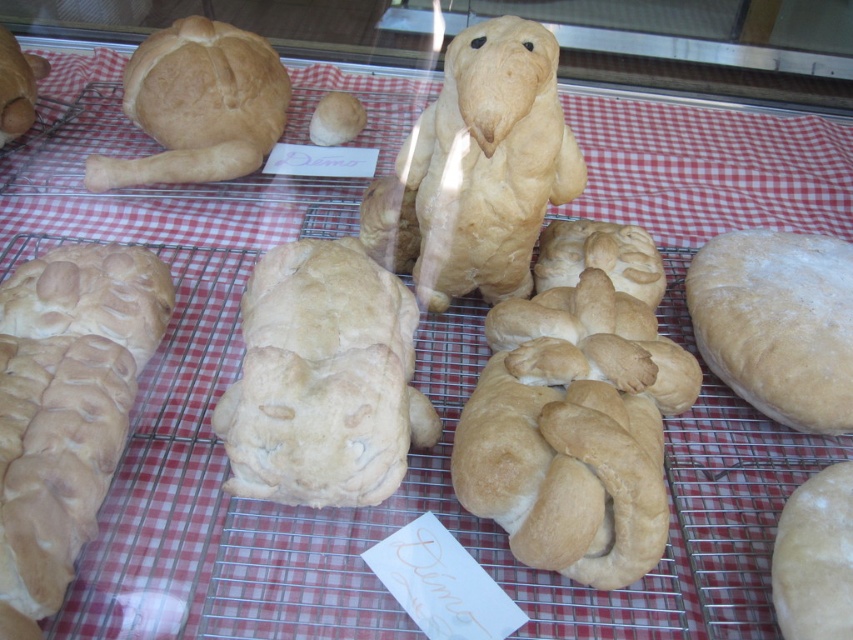
Is point (6, 499) closer to viewer compared to point (152, 161)?

Yes, point (6, 499) is in front of point (152, 161).

You are a GUI agent. You are given a task and a screenshot of the screen. Output one action in this format:
    pyautogui.click(x=<x>, y=<y>)
    Task: Click on the golden brown crusty loaf at lower left
    The height and width of the screenshot is (640, 853).
    Given the screenshot: What is the action you would take?
    pyautogui.click(x=67, y=408)

Identify the location of golden brown crusty loaf at lower left. The height and width of the screenshot is (640, 853). (67, 408).

Between point (49, 259) and point (289, 340), which one is positioned in front?

Point (289, 340) is in front.

Can you confirm if golden brown crusty loaf at lower left is positioned to the left of golden brown doughnut at center?

Yes, golden brown crusty loaf at lower left is to the left of golden brown doughnut at center.

The image size is (853, 640). What are the coordinates of `golden brown crusty loaf at lower left` in the screenshot? It's located at (67, 408).

Is golden brown crusty loaf at upper left closer to the viewer compared to smooth white loaf at lower right?

No, golden brown crusty loaf at upper left is further to the viewer.

What do you see at coordinates (198, 106) in the screenshot? This screenshot has width=853, height=640. I see `golden brown crusty loaf at upper left` at bounding box center [198, 106].

Where is `golden brown crusty loaf at upper left`? The height and width of the screenshot is (640, 853). golden brown crusty loaf at upper left is located at coordinates (198, 106).